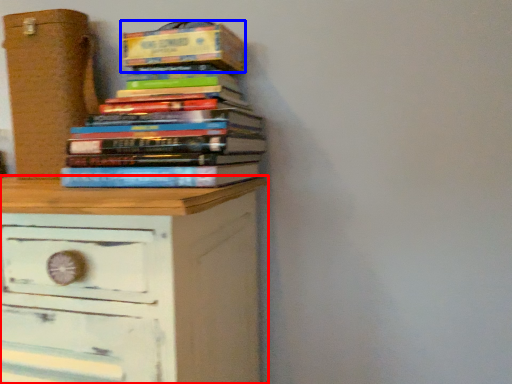
Question: Which point is closer to the camera, chest of drawers (highlighted by a red box) or paperback book (highlighted by a blue box)?

Choices:
 (A) chest of drawers
 (B) paperback book

Answer: (A)